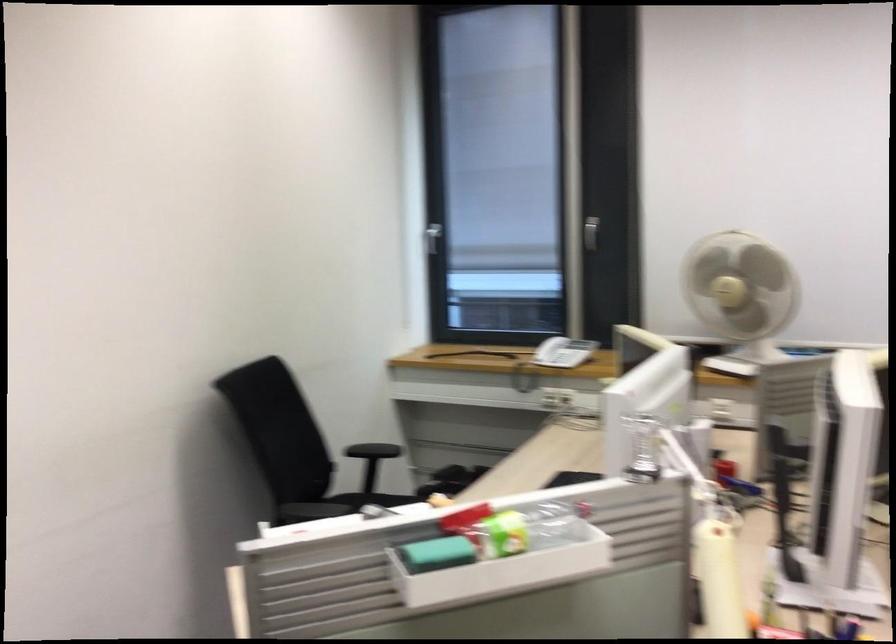
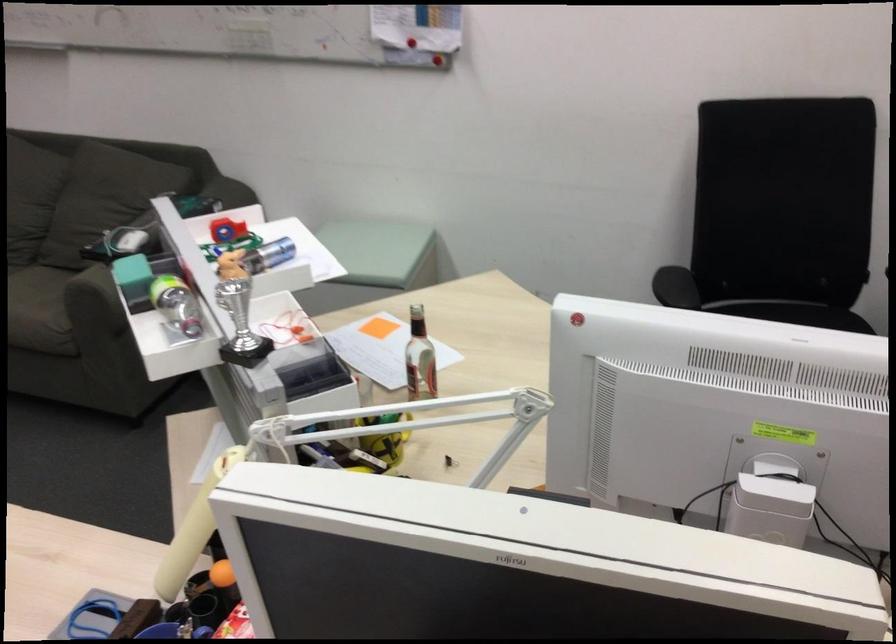
In the second image, find the point that corresponds to point (352, 518) in the first image.

(274, 252)